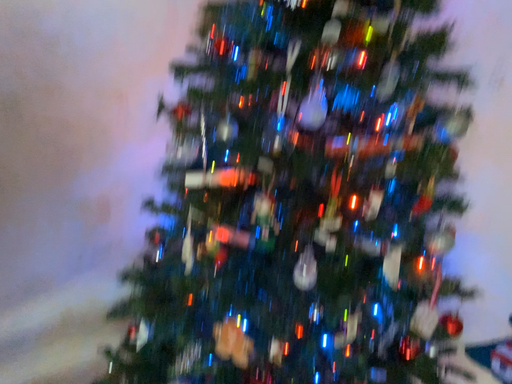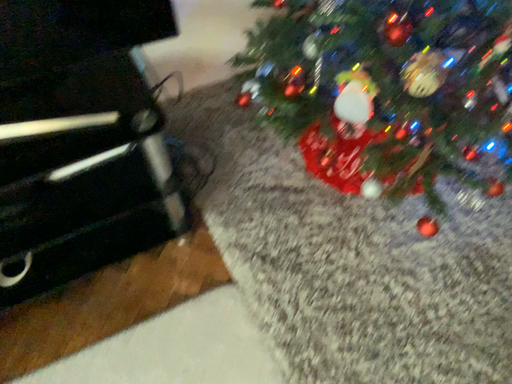
Question: Which way did the camera rotate in the video?

Choices:
 (A) rotated downward
 (B) rotated upward

Answer: (A)